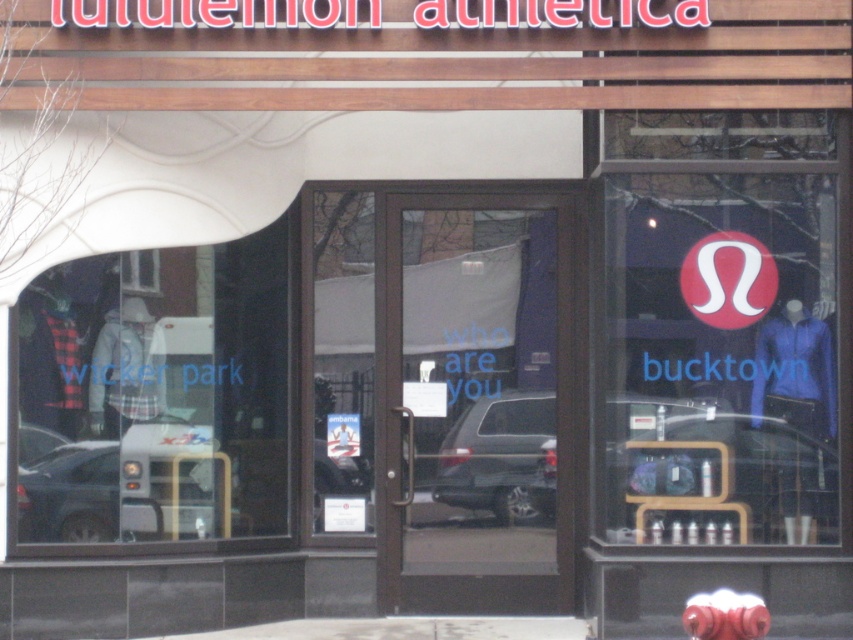
Question: Can you confirm if matte black clothing at left is bigger than metallic silver bus at lower left?

Choices:
 (A) yes
 (B) no

Answer: (A)

Question: Does matte black clothing at left appear under satin silver suv at center?

Choices:
 (A) yes
 (B) no

Answer: (B)

Question: Estimate the real-world distances between objects in this image. Which object is farther from the rubberized red fire hydrant at lower center?

Choices:
 (A) matte black clothing at left
 (B) metallic silver bus at lower left

Answer: (A)

Question: Is satin silver suv at center thinner than rubberized red fire hydrant at lower center?

Choices:
 (A) yes
 (B) no

Answer: (B)

Question: Which of the following is the closest to the observer?

Choices:
 (A) satin silver suv at center
 (B) metallic silver bus at lower left
 (C) matte black clothing at left
 (D) rubberized red fire hydrant at lower center

Answer: (D)

Question: Among these points, which one is nearest to the camera?

Choices:
 (A) (527, 401)
 (B) (50, 401)
 (C) (160, 492)

Answer: (B)